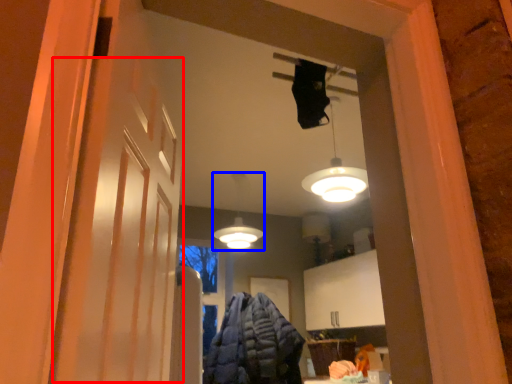
Question: Which object is further to the camera taking this photo, barn door (highlighted by a red box) or lamp (highlighted by a blue box)?

Choices:
 (A) barn door
 (B) lamp

Answer: (B)